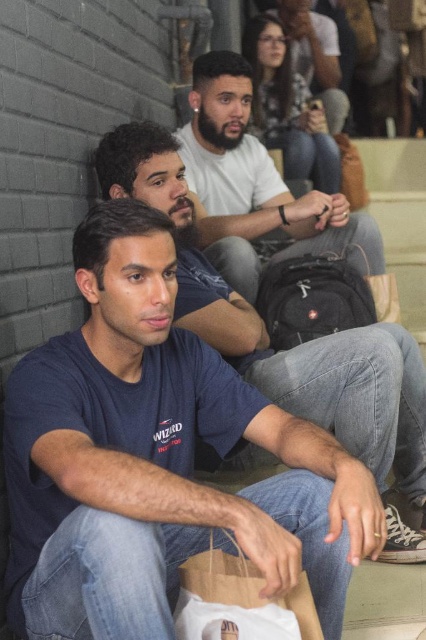
Is point (199, 598) positioned in front of point (322, 65)?

Yes, it is in front of point (322, 65).

Is brown paper bag at lower center positioned before bearded man at center?

That is True.

Is point (224, 604) behind point (302, 52)?

No, (224, 604) is in front of (302, 52).

Locate an element on the screen. brown paper bag at lower center is located at coordinates (238, 602).

Does point (169, 180) come behind point (325, 80)?

No, (169, 180) is closer to viewer.

Can you confirm if blue cotton t-shirt at center is thinner than bearded man at center?

Incorrect, blue cotton t-shirt at center's width is not less than bearded man at center's.

Does point (236, 301) come farther from viewer compared to point (328, 125)?

No.

Find the location of a particular element. blue cotton t-shirt at center is located at coordinates (267, 336).

Is white cotton t-shirt at center closer to camera compared to bearded man at center?

Yes, white cotton t-shirt at center is closer to the viewer.

Can you confirm if white cotton t-shirt at center is positioned to the left of bearded man at center?

Indeed, white cotton t-shirt at center is positioned on the left side of bearded man at center.

The image size is (426, 640). Describe the element at coordinates (256, 186) in the screenshot. I see `white cotton t-shirt at center` at that location.

Locate an element on the screen. This screenshot has width=426, height=640. white cotton t-shirt at center is located at coordinates (256, 186).